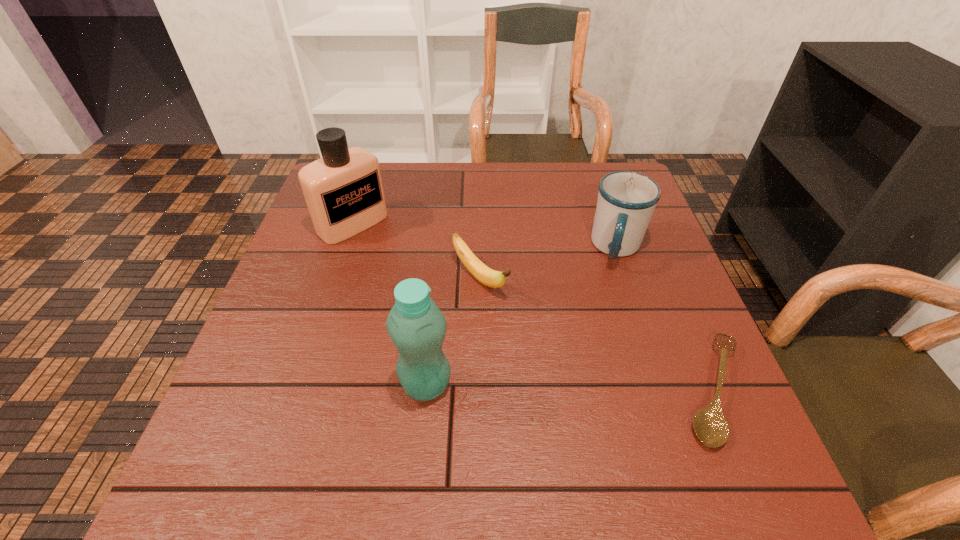
You are a GUI agent. You are given a task and a screenshot of the screen. Output one action in this format:
    pyautogui.click(x=<x>, y=<y>)
    Task: Click on the free space between the ladle and the water bottle
    The height and width of the screenshot is (540, 960).
    Given the screenshot: What is the action you would take?
    pyautogui.click(x=570, y=387)

Find the location of a particular element. vacant space in between the water bottle and the ladle is located at coordinates tap(570, 387).

Where is `empty space between the banana and the third tallest object`? This screenshot has width=960, height=540. empty space between the banana and the third tallest object is located at coordinates (548, 263).

In order to click on vacant area between the water bottle and the banana in this screenshot , I will do `click(453, 332)`.

In order to click on empty space that is in between the shortest object and the fourth tallest object in this screenshot , I will do `click(597, 334)`.

This screenshot has width=960, height=540. I want to click on vacant space that is in between the shortest object and the fourth tallest object, so click(x=597, y=334).

Locate an element on the screen. This screenshot has width=960, height=540. free area in between the perfume and the second shortest object is located at coordinates (417, 252).

This screenshot has width=960, height=540. I want to click on free space between the water bottle and the third tallest object, so click(521, 316).

Identify the location of free area in between the shortest object and the banana. (597, 334).

Image resolution: width=960 pixels, height=540 pixels. Find the location of `free space between the shortest object and the third shortest object`. free space between the shortest object and the third shortest object is located at coordinates (665, 319).